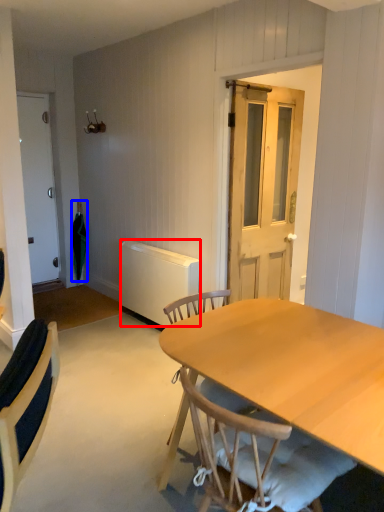
Question: Among these objects, which one is nearest to the camera, radiator (highlighted by a red box) or umbrella (highlighted by a blue box)?

Choices:
 (A) radiator
 (B) umbrella

Answer: (A)